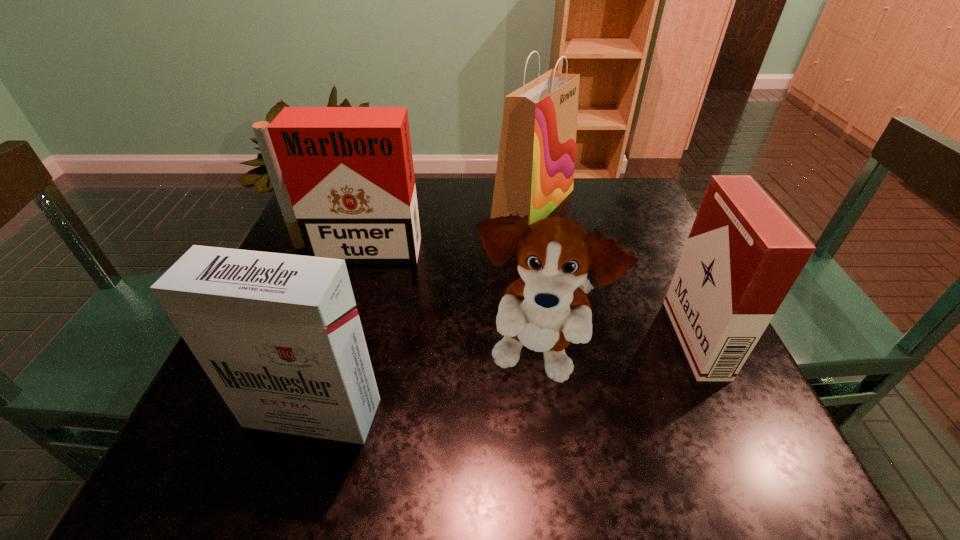
Identify which cigarette_case is the second closest to the farthest cigarette_case. Please provide its 2D coordinates. Your answer should be formatted as a tuple, i.e. [(x, y)], where the tuple contains the x and y coordinates of a point satisfying the conditions above.

[(743, 254)]

The width and height of the screenshot is (960, 540). Find the location of `vacant region that satisfies the following two spatial constraints: 1. on the front-facing side of the second nearest cigarette_case; 2. on the face of the puppy`. vacant region that satisfies the following two spatial constraints: 1. on the front-facing side of the second nearest cigarette_case; 2. on the face of the puppy is located at coordinates (705, 359).

Where is `free point that satisfies the following two spatial constraints: 1. on the back side of the tallest object; 2. on the left side of the nearest cigarette_case`? free point that satisfies the following two spatial constraints: 1. on the back side of the tallest object; 2. on the left side of the nearest cigarette_case is located at coordinates (378, 205).